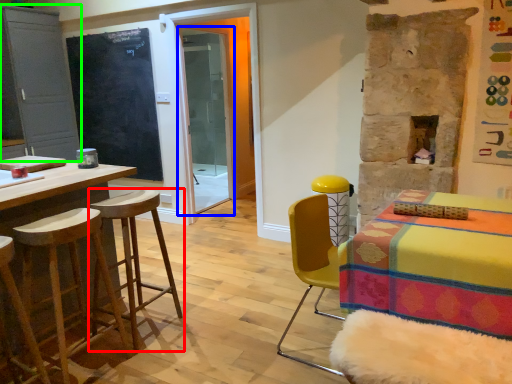
Question: Based on their relative distances, which object is farther from stool (highlighted by a red box)? Choose from screen door (highlighted by a blue box) and cabinetry (highlighted by a green box).

Choices:
 (A) screen door
 (B) cabinetry

Answer: (A)